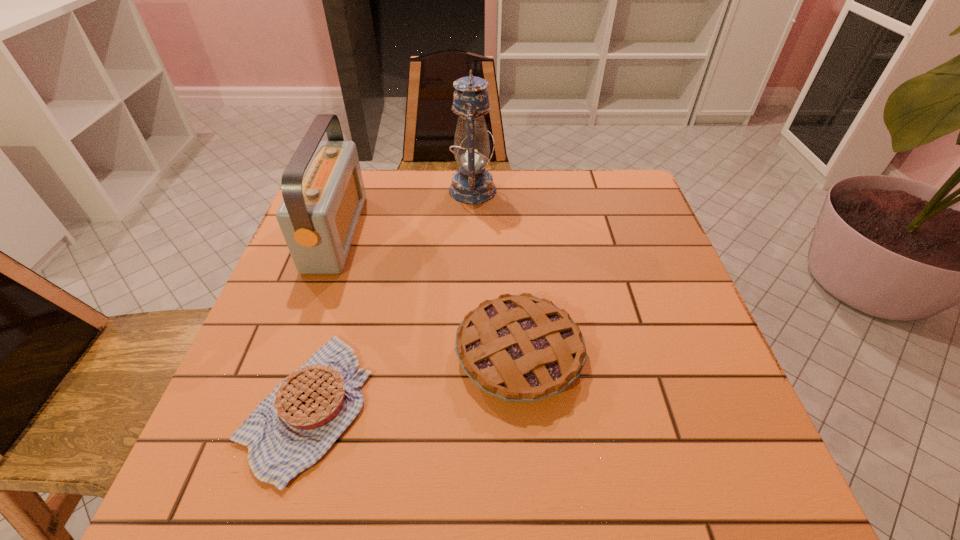
The image size is (960, 540). I want to click on vacant space that's between the second shortest object and the shorter pie, so click(x=413, y=380).

Identify the location of free space between the taller pie and the lantern. (496, 272).

Identify which object is the third closest to the shorter pie. Please provide its 2D coordinates. Your answer should be formatted as a tuple, i.e. [(x, y)], where the tuple contains the x and y coordinates of a point satisfying the conditions above.

[(472, 184)]

Identify the location of object that is the third closest one to the shorter pie. (472, 184).

Image resolution: width=960 pixels, height=540 pixels. Identify the location of vacant space that satisfies the following two spatial constraints: 1. on the front-facing side of the radio receiver; 2. on the back side of the shortest object. (274, 405).

Find the location of a particular element. free spot that satisfies the following two spatial constraints: 1. on the front-facing side of the third shortest object; 2. on the back side of the shortest object is located at coordinates (274, 405).

Find the location of a particular element. Image resolution: width=960 pixels, height=540 pixels. vacant area in the image that satisfies the following two spatial constraints: 1. on the back side of the taller pie; 2. on the front-facing side of the third shortest object is located at coordinates (510, 232).

Find the location of a particular element. free spot that satisfies the following two spatial constraints: 1. on the front-facing side of the third shortest object; 2. on the left side of the shortest object is located at coordinates (274, 405).

Image resolution: width=960 pixels, height=540 pixels. Identify the location of vacant space that satisfies the following two spatial constraints: 1. on the front-facing side of the taller pie; 2. on the left side of the tallest object. (469, 354).

Where is `free spot that satisfies the following two spatial constraints: 1. on the back side of the right pie; 2. on the front-facing side of the tallest object`? This screenshot has height=540, width=960. free spot that satisfies the following two spatial constraints: 1. on the back side of the right pie; 2. on the front-facing side of the tallest object is located at coordinates (507, 190).